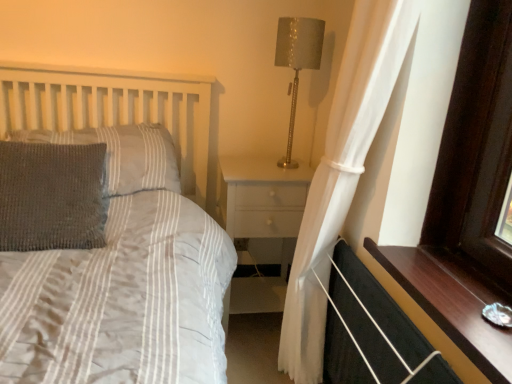
Question: Can you confirm if black fabric balustrade at lower right is taller than white wood nightstand at center?

Choices:
 (A) no
 (B) yes

Answer: (A)

Question: Is black fabric balustrade at lower right thinner than white wood nightstand at center?

Choices:
 (A) yes
 (B) no

Answer: (A)

Question: Can you confirm if black fabric balustrade at lower right is bigger than white wood nightstand at center?

Choices:
 (A) no
 (B) yes

Answer: (A)

Question: From a real-world perspective, is black fabric balustrade at lower right beneath white wood nightstand at center?

Choices:
 (A) yes
 (B) no

Answer: (A)

Question: From the image's perspective, does black fabric balustrade at lower right appear higher than white wood nightstand at center?

Choices:
 (A) yes
 (B) no

Answer: (B)

Question: Does black fabric balustrade at lower right have a smaller size compared to white wood nightstand at center?

Choices:
 (A) no
 (B) yes

Answer: (B)

Question: Does white sheer curtain at right turn towards woolen gray pillow at left, acting as the 2th pillow starting from the front?

Choices:
 (A) yes
 (B) no

Answer: (B)

Question: Does white sheer curtain at right have a smaller size compared to woolen gray pillow at left, positioned as the first pillow in back-to-front order?

Choices:
 (A) yes
 (B) no

Answer: (B)

Question: Is woolen gray pillow at left, positioned as the first pillow in back-to-front order, inside white sheer curtain at right?

Choices:
 (A) no
 (B) yes

Answer: (A)

Question: Is white sheer curtain at right to the left of woolen gray pillow at left, acting as the 2th pillow starting from the front, from the viewer's perspective?

Choices:
 (A) yes
 (B) no

Answer: (B)

Question: From a real-world perspective, is white sheer curtain at right over woolen gray pillow at left, acting as the 2th pillow starting from the front?

Choices:
 (A) no
 (B) yes

Answer: (A)

Question: Considering the relative sizes of white sheer curtain at right and woolen gray pillow at left, acting as the 2th pillow starting from the front, in the image provided, is white sheer curtain at right wider than woolen gray pillow at left, acting as the 2th pillow starting from the front,?

Choices:
 (A) no
 (B) yes

Answer: (A)

Question: Is woolen gray pillow at left, positioned as the first pillow in back-to-front order, looking in the opposite direction of white sheer curtain at right?

Choices:
 (A) no
 (B) yes

Answer: (A)